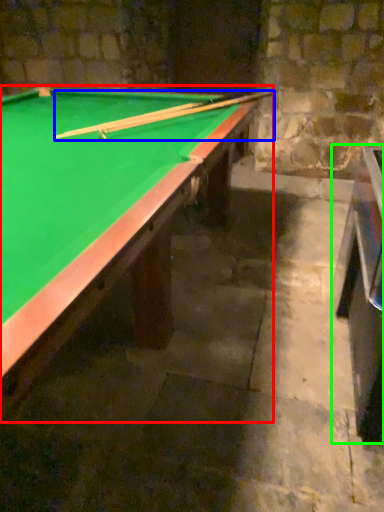
Question: Estimate the real-world distances between objects in this image. Which object is closer to billiard table (highlighted by a red box), cue (highlighted by a blue box) or table (highlighted by a green box)?

Choices:
 (A) cue
 (B) table

Answer: (A)